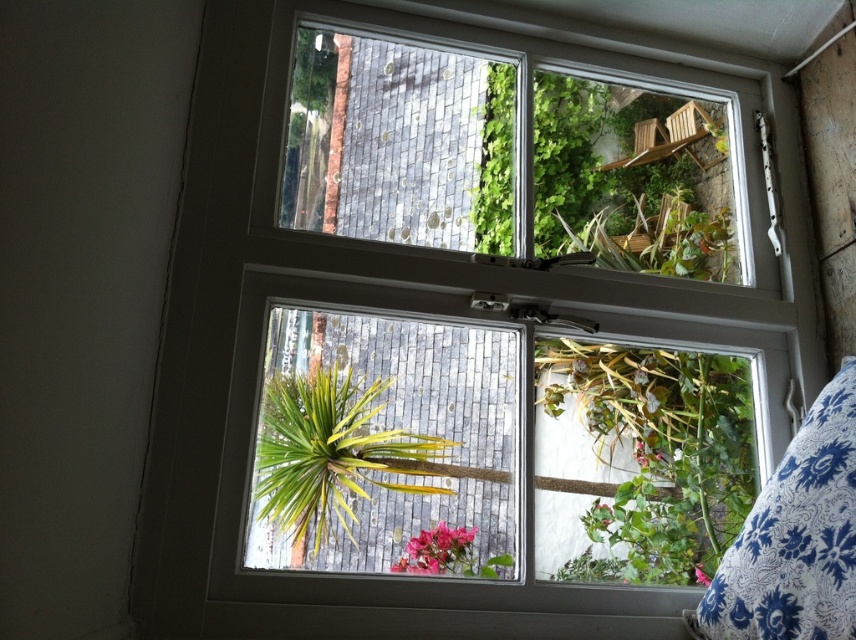
Question: Which point is closer to the camera?

Choices:
 (A) (421, 536)
 (B) (655, 582)
 (C) (818, 416)

Answer: (C)

Question: Can you confirm if blue floral fabric pillow at lower right is smaller than pink matte flower at lower center?

Choices:
 (A) yes
 (B) no

Answer: (B)

Question: From the image, what is the correct spatial relationship of blue floral fabric pillow at lower right in relation to pink matte flower at lower center?

Choices:
 (A) below
 (B) above

Answer: (B)

Question: Does green leafy plant at lower right have a smaller size compared to blue floral fabric pillow at lower right?

Choices:
 (A) yes
 (B) no

Answer: (B)

Question: Estimate the real-world distances between objects in this image. Which object is closer to the blue floral fabric pillow at lower right?

Choices:
 (A) pink matte flower at lower center
 (B) green leafy plant at lower right
 (C) green leafy plant at center

Answer: (B)

Question: Which of the following is the farthest from the observer?

Choices:
 (A) (409, 483)
 (B) (462, 572)
 (C) (702, 550)

Answer: (C)